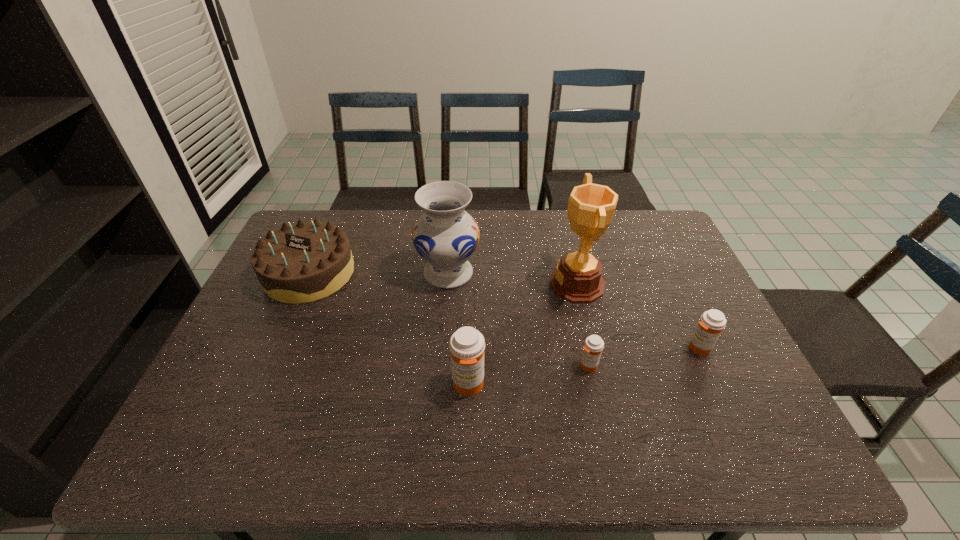
Where is `free space located on the left of the shortest object`? This screenshot has width=960, height=540. free space located on the left of the shortest object is located at coordinates (490, 366).

The image size is (960, 540). Identify the location of vacant space located on the left of the rightmost object. (639, 348).

The width and height of the screenshot is (960, 540). In order to click on vacant space situated on the front of the vase in this screenshot , I will do `click(442, 355)`.

This screenshot has height=540, width=960. In order to click on free region located on the front-facing side of the award in this screenshot , I will do `click(416, 284)`.

Locate an element on the screen. free space located 0.380m on the front-facing side of the award is located at coordinates (422, 284).

This screenshot has height=540, width=960. I want to click on free space located 0.310m on the front-facing side of the award, so click(445, 284).

Identify the location of free region located 0.290m on the front-facing side of the birthday cake. (257, 393).

Identify the location of object that is positioned at the far edge. The image size is (960, 540). (300, 263).

Locate an element on the screen. This screenshot has height=540, width=960. object that is at the near edge is located at coordinates (467, 345).

You are a GUI agent. You are given a task and a screenshot of the screen. Output one action in this format:
    pyautogui.click(x=<x>, y=<y>)
    Task: Click on the object located at the left edge
    
    Given the screenshot: What is the action you would take?
    pyautogui.click(x=300, y=263)